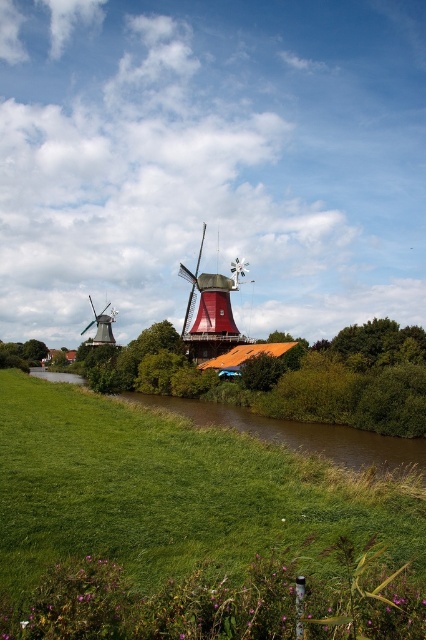
Question: Can you confirm if green grassy at center is positioned above red wood windmill at center?

Choices:
 (A) yes
 (B) no

Answer: (B)

Question: Which of these objects is positioned farthest from the matte red windmill at left?

Choices:
 (A) green grassy at center
 (B) red wood windmill at center

Answer: (A)

Question: Does brown grassy river at center have a larger size compared to matte red windmill at left?

Choices:
 (A) yes
 (B) no

Answer: (A)

Question: Is green grassy at center wider than brown grassy river at center?

Choices:
 (A) no
 (B) yes

Answer: (A)

Question: Which of the following is the closest to the observer?

Choices:
 (A) matte red windmill at left
 (B) green grassy at center
 (C) brown grassy river at center
 (D) red wood windmill at center

Answer: (B)

Question: Among these objects, which one is farthest from the camera?

Choices:
 (A) matte red windmill at left
 (B) brown grassy river at center
 (C) red wood windmill at center

Answer: (A)